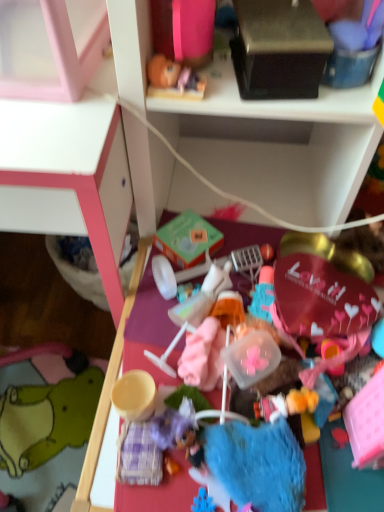
Question: Is plastic toy at center positioned in front of white plastic shelf at upper center?

Choices:
 (A) no
 (B) yes

Answer: (A)

Question: Is plastic toy at center with white plastic shelf at upper center?

Choices:
 (A) no
 (B) yes

Answer: (A)

Question: Is there a large distance between plastic toy at center and white plastic shelf at upper center?

Choices:
 (A) no
 (B) yes

Answer: (A)

Question: From the image's perspective, is plastic toy at center on top of white plastic shelf at upper center?

Choices:
 (A) yes
 (B) no

Answer: (B)

Question: Is plastic toy at center shorter than white plastic shelf at upper center?

Choices:
 (A) yes
 (B) no

Answer: (A)

Question: Does plastic toy at center turn towards white plastic shelf at upper center?

Choices:
 (A) yes
 (B) no

Answer: (B)

Question: Does plastic toy at center come behind green felt plush at lower left?

Choices:
 (A) yes
 (B) no

Answer: (B)

Question: Is plastic toy at center surrounding green felt plush at lower left?

Choices:
 (A) no
 (B) yes

Answer: (A)

Question: Can you confirm if plastic toy at center is positioned to the right of green felt plush at lower left?

Choices:
 (A) no
 (B) yes

Answer: (B)

Question: Can you confirm if plastic toy at center is taller than green felt plush at lower left?

Choices:
 (A) no
 (B) yes

Answer: (A)

Question: Is plastic toy at center at the left side of green felt plush at lower left?

Choices:
 (A) yes
 (B) no

Answer: (B)

Question: Can you confirm if plastic toy at center is smaller than green felt plush at lower left?

Choices:
 (A) yes
 (B) no

Answer: (A)

Question: Is green felt plush at lower left turned away from white plastic shelf at upper center?

Choices:
 (A) no
 (B) yes

Answer: (A)